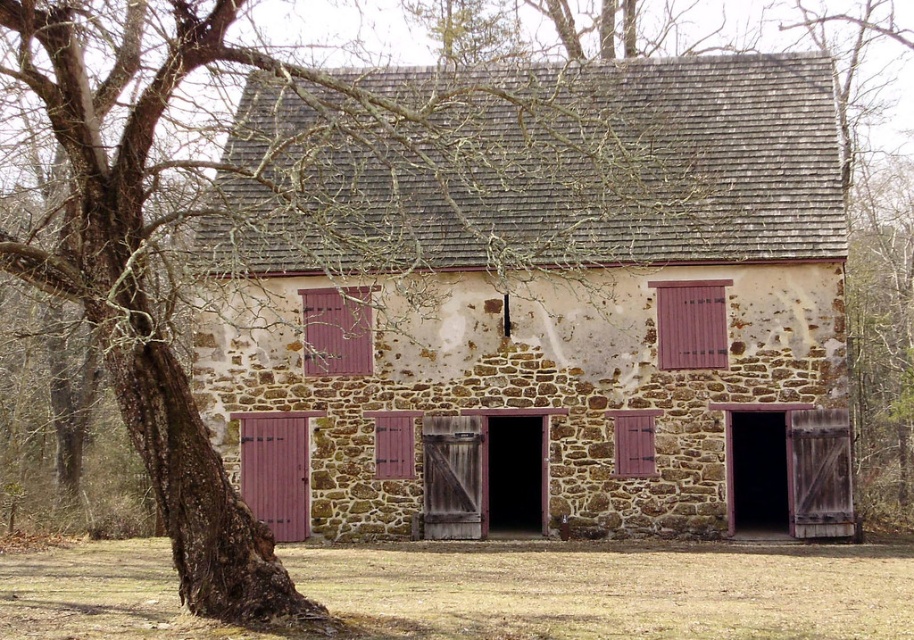
Consider the image. You are a painter who needs to decide which item requires more paint between the matte wood door at lower left and the wooden textured shutter at center. Based on their sizes, which one would need more paint?

The matte wood door at lower left requires more paint because its width surpasses that of the wooden textured shutter at center, indicating it has a larger surface area to cover.

You are standing in front of the rustic stone building and notice two shutters, the purple wood shutter at right and the pink wood shutter at center. Which shutter is positioned more to the east side of the building?

The purple wood shutter at right is positioned more to the east side of the building because it is to the right of the pink wood shutter at center, assuming the observer is facing the building.

You are standing in front of the rustic stone building and want to locate the purple wood shutter at right. Where exactly is it positioned in the image?

The purple wood shutter at right is located at point (689, 323) in the image.